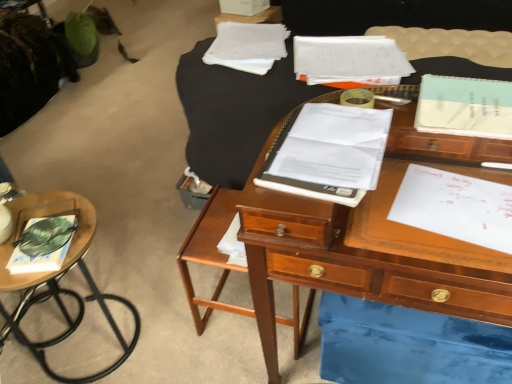
Question: From a real-world perspective, does wooden desk at center, the first table positioned from the right, stand above wooden side table at lower left, positioned as the first table in left-to-right order?

Choices:
 (A) yes
 (B) no

Answer: (A)

Question: Considering the relative positions of wooden desk at center, the first table positioned from the right, and wooden side table at lower left, the second table viewed from the right, in the image provided, is wooden desk at center, the first table positioned from the right, in front of wooden side table at lower left, the second table viewed from the right,?

Choices:
 (A) yes
 (B) no

Answer: (A)

Question: Is wooden side table at lower left, the second table viewed from the right, surrounded by wooden desk at center, positioned as the second table in left-to-right order?

Choices:
 (A) no
 (B) yes

Answer: (A)

Question: Does wooden desk at center, positioned as the second table in left-to-right order, turn towards wooden side table at lower left, the second table viewed from the right?

Choices:
 (A) yes
 (B) no

Answer: (B)

Question: Can you confirm if wooden desk at center, positioned as the second table in left-to-right order, is wider than wooden side table at lower left, the second table viewed from the right?

Choices:
 (A) no
 (B) yes

Answer: (B)

Question: Is wooden desk at center, positioned as the second table in left-to-right order, far away from wooden side table at lower left, the second table viewed from the right?

Choices:
 (A) no
 (B) yes

Answer: (A)

Question: Is white paper at right looking in the opposite direction of wooden side table at lower left, positioned as the first table in left-to-right order?

Choices:
 (A) no
 (B) yes

Answer: (A)

Question: From a real-world perspective, is white paper at right positioned over wooden side table at lower left, positioned as the first table in left-to-right order, based on gravity?

Choices:
 (A) yes
 (B) no

Answer: (A)

Question: Can you confirm if white paper at right is positioned to the left of wooden side table at lower left, the second table viewed from the right?

Choices:
 (A) no
 (B) yes

Answer: (A)

Question: Is white paper at right positioned behind wooden side table at lower left, the second table viewed from the right?

Choices:
 (A) no
 (B) yes

Answer: (A)

Question: Considering the relative sizes of white paper at right and wooden side table at lower left, positioned as the first table in left-to-right order, in the image provided, is white paper at right taller than wooden side table at lower left, positioned as the first table in left-to-right order,?

Choices:
 (A) no
 (B) yes

Answer: (A)

Question: Is white paper at right completely or partially outside of wooden side table at lower left, positioned as the first table in left-to-right order?

Choices:
 (A) no
 (B) yes

Answer: (B)

Question: Does white paper notebook at center, positioned as the first notebook in front-to-back order, have a smaller size compared to white paper at right?

Choices:
 (A) no
 (B) yes

Answer: (A)